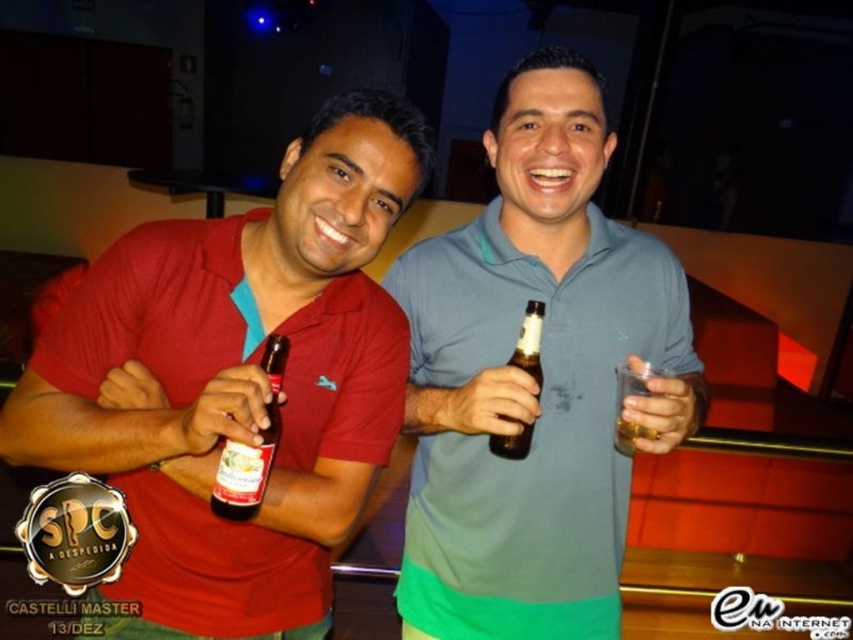
Is matte red shirt at left to the left of brown glass bottle at center from the viewer's perspective?

Correct, you'll find matte red shirt at left to the left of brown glass bottle at center.

The height and width of the screenshot is (640, 853). Describe the element at coordinates (239, 380) in the screenshot. I see `matte red shirt at left` at that location.

Is point (163, 548) less distant than point (519, 349)?

No, it is behind (519, 349).

Where is `matte red shirt at left`? matte red shirt at left is located at coordinates (239, 380).

Between point (213, 509) and point (631, 451), which one is positioned in front?

Positioned in front is point (213, 509).

Between point (265, 340) and point (635, 362), which one is positioned behind?

Point (635, 362)

You are a GUI agent. You are given a task and a screenshot of the screen. Output one action in this format:
    pyautogui.click(x=<x>, y=<y>)
    Task: Click on the matte glass bottle at center
    This screenshot has height=640, width=853.
    Given the screenshot: What is the action you would take?
    pyautogui.click(x=251, y=448)

Between point (532, 304) and point (622, 381), which one is positioned in front?

Positioned in front is point (532, 304).

Can you confirm if brown glass bottle at center is positioned to the left of translucent glass at right?

Yes, brown glass bottle at center is to the left of translucent glass at right.

Which is in front, point (537, 305) or point (636, 381)?

Point (537, 305) is in front.

The image size is (853, 640). Identify the location of brown glass bottle at center. (529, 340).